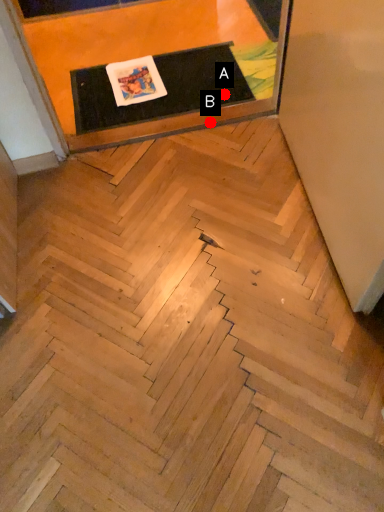
Question: Two points are circled on the image, labeled by A and B beside each circle. Which point appears farthest from the camera in this image?

Choices:
 (A) A is further
 (B) B is further

Answer: (A)